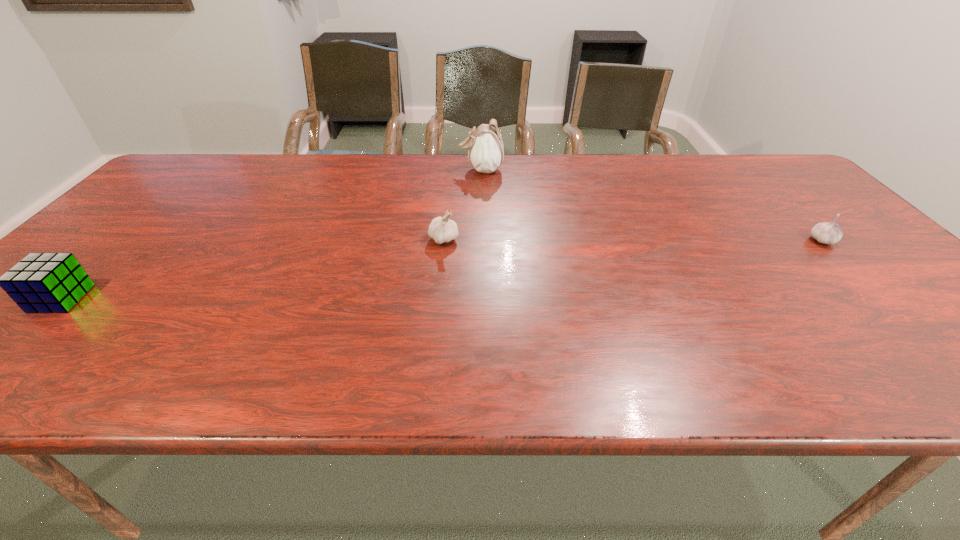
The height and width of the screenshot is (540, 960). In the image, there is a desktop. Identify the location of vacant region at the far left corner. (188, 167).

Where is `blank region between the cube and the pouch`? blank region between the cube and the pouch is located at coordinates (271, 234).

Locate an element on the screen. The image size is (960, 540). empty space between the rightmost object and the cube is located at coordinates (442, 269).

Find the location of `free space between the left garlic and the rightmost object`. free space between the left garlic and the rightmost object is located at coordinates (634, 240).

Locate an element on the screen. This screenshot has width=960, height=540. free space between the shorter garlic and the tallest object is located at coordinates (652, 205).

What are the coordinates of `unoccupied area between the cube and the left garlic` in the screenshot? It's located at (252, 269).

Where is `unoccupied area between the nearest object and the rightmost object`? This screenshot has width=960, height=540. unoccupied area between the nearest object and the rightmost object is located at coordinates (442, 269).

Identify the location of vacant area that lies between the left garlic and the nearest object. Image resolution: width=960 pixels, height=540 pixels. (252, 269).

The height and width of the screenshot is (540, 960). Identify the location of free area in between the left garlic and the farthest object. (463, 205).

Image resolution: width=960 pixels, height=540 pixels. Identify the location of vacant area that lies between the cube and the rightmost object. (442, 269).